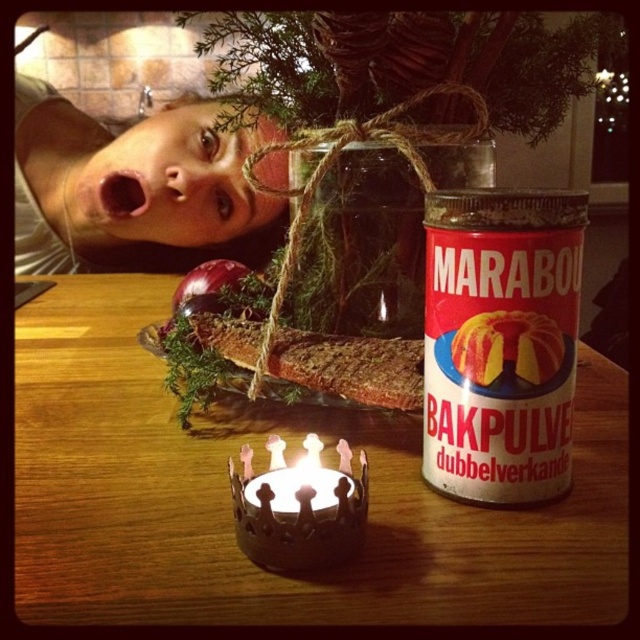
Is red matte tin can at right above metallic crown-shaped candle at lower center?

Correct, red matte tin can at right is located above metallic crown-shaped candle at lower center.

Which is in front, point (520, 342) or point (260, 531)?

Point (260, 531) is more forward.

Where is `red matte tin can at right`? The image size is (640, 640). red matte tin can at right is located at coordinates (500, 340).

Who is positioned more to the left, matte white face at upper left or metallic crown-shaped candle at lower center?

matte white face at upper left

Is matte white face at upper left smaller than metallic crown-shaped candle at lower center?

Incorrect, matte white face at upper left is not smaller in size than metallic crown-shaped candle at lower center.

Where is `matte white face at upper left`? This screenshot has width=640, height=640. matte white face at upper left is located at coordinates (132, 188).

Is point (104, 186) farther from viewer compared to point (316, 472)?

Yes, point (104, 186) is farther from viewer.

Locate an element on the screen. matte white face at upper left is located at coordinates (132, 188).

Where is `matte white face at upper left`? matte white face at upper left is located at coordinates (132, 188).